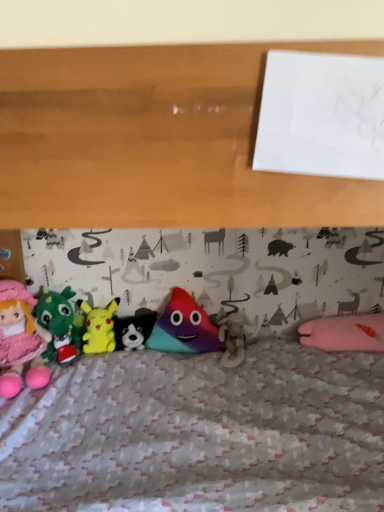
Question: Is matte pink plush doll at left, which is counted as the first toy, starting from the left, directly adjacent to fluffy white teddy bear at center, the 1th toy when ordered from right to left?

Choices:
 (A) no
 (B) yes

Answer: (A)

Question: Does matte pink plush doll at left, which is counted as the 6th toy, starting from the right, appear on the right side of fluffy white teddy bear at center, which ranks as the 6th toy in left-to-right order?

Choices:
 (A) yes
 (B) no

Answer: (B)

Question: Is matte pink plush doll at left, which is counted as the first toy, starting from the left, wider than fluffy white teddy bear at center, which ranks as the 6th toy in left-to-right order?

Choices:
 (A) yes
 (B) no

Answer: (A)

Question: Can you confirm if matte pink plush doll at left, which is counted as the first toy, starting from the left, is thinner than fluffy white teddy bear at center, the 1th toy when ordered from right to left?

Choices:
 (A) yes
 (B) no

Answer: (B)

Question: Can you confirm if matte pink plush doll at left, which is counted as the 6th toy, starting from the right, is shorter than fluffy white teddy bear at center, the 1th toy when ordered from right to left?

Choices:
 (A) yes
 (B) no

Answer: (B)

Question: Looking at their shapes, would you say matte pink plush doll at left, which is counted as the 6th toy, starting from the right, is wider or thinner than fluffy white teddy bear at center, which ranks as the 6th toy in left-to-right order?

Choices:
 (A) thin
 (B) wide

Answer: (B)

Question: Considering the relative positions of matte pink plush doll at left, which is counted as the first toy, starting from the left, and fluffy white teddy bear at center, which ranks as the 6th toy in left-to-right order, in the image provided, is matte pink plush doll at left, which is counted as the first toy, starting from the left, to the left or to the right of fluffy white teddy bear at center, which ranks as the 6th toy in left-to-right order,?

Choices:
 (A) left
 (B) right

Answer: (A)

Question: Choose the correct answer: Is matte pink plush doll at left, which is counted as the 6th toy, starting from the right, inside fluffy white teddy bear at center, the 1th toy when ordered from right to left, or outside it?

Choices:
 (A) inside
 (B) outside

Answer: (B)

Question: Is point (3, 284) positioned closer to the camera than point (218, 310)?

Choices:
 (A) farther
 (B) closer

Answer: (B)

Question: Choose the correct answer: Is velvet green dragon at left, the 5th toy in the right-to-left sequence, inside fluffy white teddy bear at center, the 1th toy when ordered from right to left, or outside it?

Choices:
 (A) outside
 (B) inside

Answer: (A)

Question: In terms of width, does velvet green dragon at left, which appears as the 2th toy when viewed from the left, look wider or thinner when compared to fluffy white teddy bear at center, which ranks as the 6th toy in left-to-right order?

Choices:
 (A) wide
 (B) thin

Answer: (B)

Question: Is velvet green dragon at left, which appears as the 2th toy when viewed from the left, to the left or to the right of fluffy white teddy bear at center, the 1th toy when ordered from right to left, in the image?

Choices:
 (A) right
 (B) left

Answer: (B)

Question: From a real-world perspective, relative to fluffy white teddy bear at center, the 1th toy when ordered from right to left, is velvet green dragon at left, the 5th toy in the right-to-left sequence, vertically above or below?

Choices:
 (A) below
 (B) above

Answer: (B)

Question: Would you say velvet green dragon at left, the 5th toy in the right-to-left sequence, is inside or outside white plush dog at center, arranged as the third toy when viewed from the right?

Choices:
 (A) outside
 (B) inside

Answer: (A)

Question: Is velvet green dragon at left, which appears as the 2th toy when viewed from the left, bigger or smaller than white plush dog at center, arranged as the third toy when viewed from the right?

Choices:
 (A) big
 (B) small

Answer: (A)